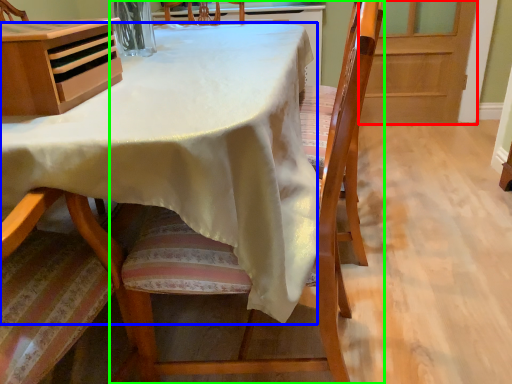
Question: Which object is the closest to the screen door (highlighted by a red box)? Choose among these: table (highlighted by a blue box) or chair (highlighted by a green box).

Choices:
 (A) table
 (B) chair

Answer: (B)